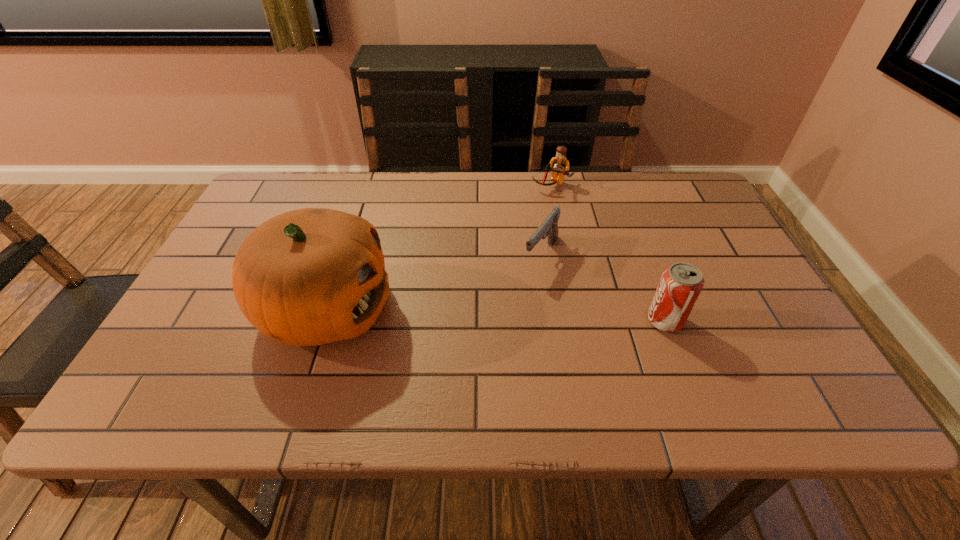
The width and height of the screenshot is (960, 540). In order to click on the second closest object to the farthest object in this screenshot , I will do `click(681, 283)`.

I want to click on the third closest object to the Lego, so click(x=307, y=277).

The width and height of the screenshot is (960, 540). I want to click on free space that satisfies the following two spatial constraints: 1. on the front side of the rightmost object; 2. on the right side of the Lego, so click(580, 321).